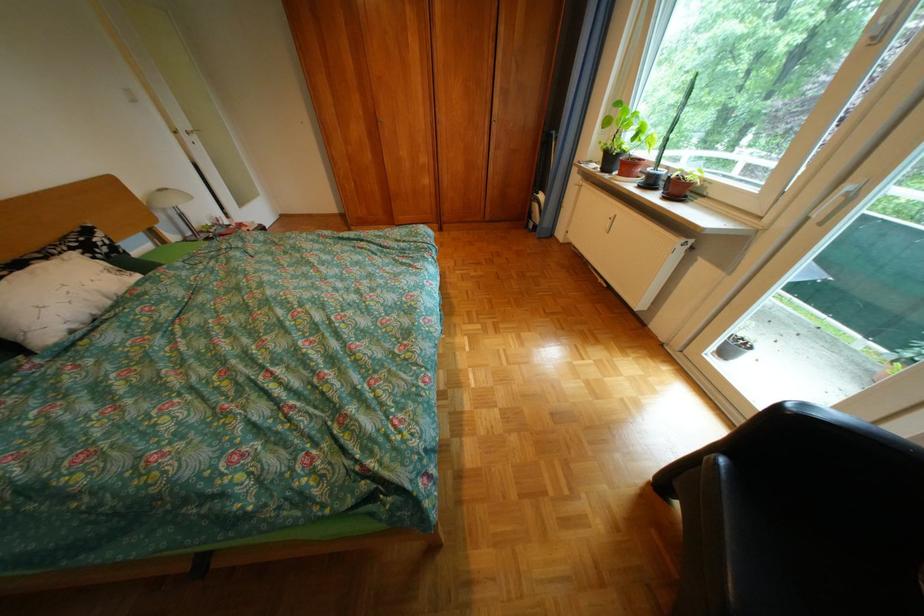
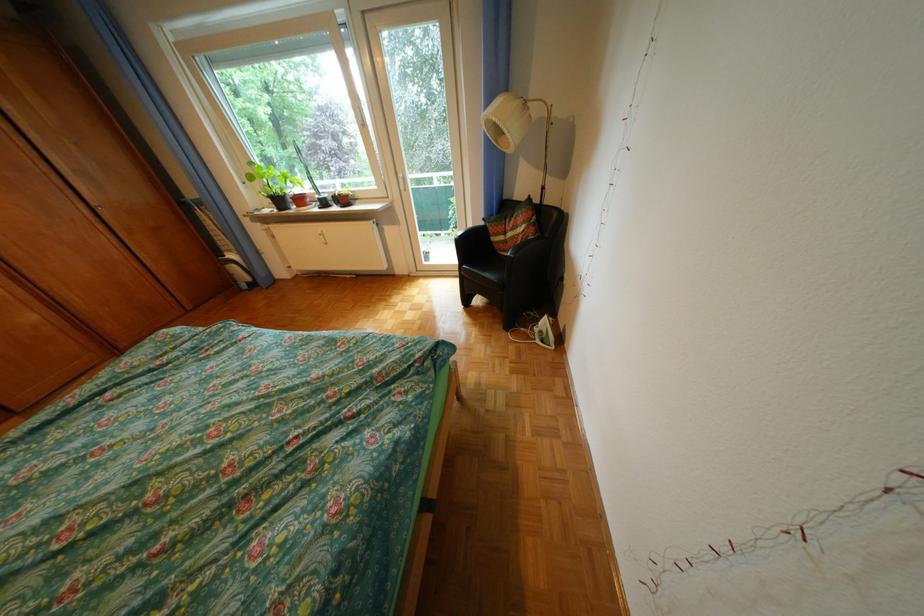
The point at [880,342] is marked in the first image. Where is the corresponding point in the second image?

(457, 233)